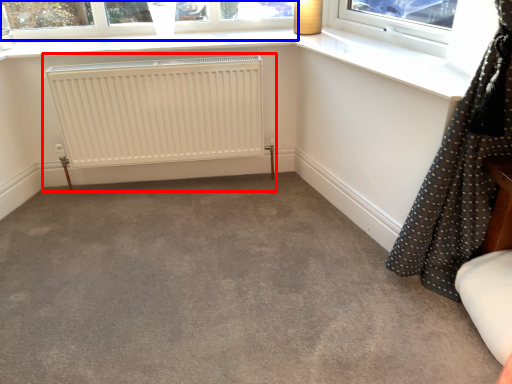
Question: Among these objects, which one is nearest to the camera, radiator (highlighted by a red box) or window (highlighted by a blue box)?

Choices:
 (A) radiator
 (B) window

Answer: (A)